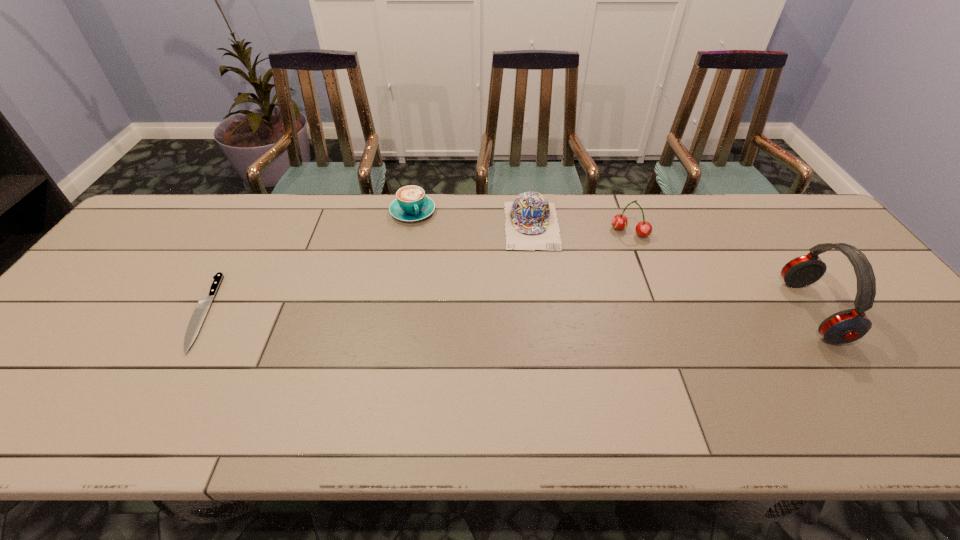
Where is `vacant region that satisfies the following two spatial constraints: 1. on the front side of the cap; 2. on the ear cups of the tallest object`? vacant region that satisfies the following two spatial constraints: 1. on the front side of the cap; 2. on the ear cups of the tallest object is located at coordinates (543, 311).

Image resolution: width=960 pixels, height=540 pixels. I want to click on vacant region that satisfies the following two spatial constraints: 1. on the front side of the cap; 2. on the ear cups of the earphone, so click(x=543, y=311).

At what (x,y) coordinates should I click in order to perform the action: click on free space that satisfies the following two spatial constraints: 1. on the back side of the second tallest object; 2. on the right side of the steak knife. Please return your answer as a coordinate pair (x, y). The width and height of the screenshot is (960, 540). Looking at the image, I should click on (250, 232).

Find the location of a particular element. This screenshot has width=960, height=540. free space that satisfies the following two spatial constraints: 1. on the front side of the third object from left to right; 2. on the left side of the cappuccino is located at coordinates (410, 226).